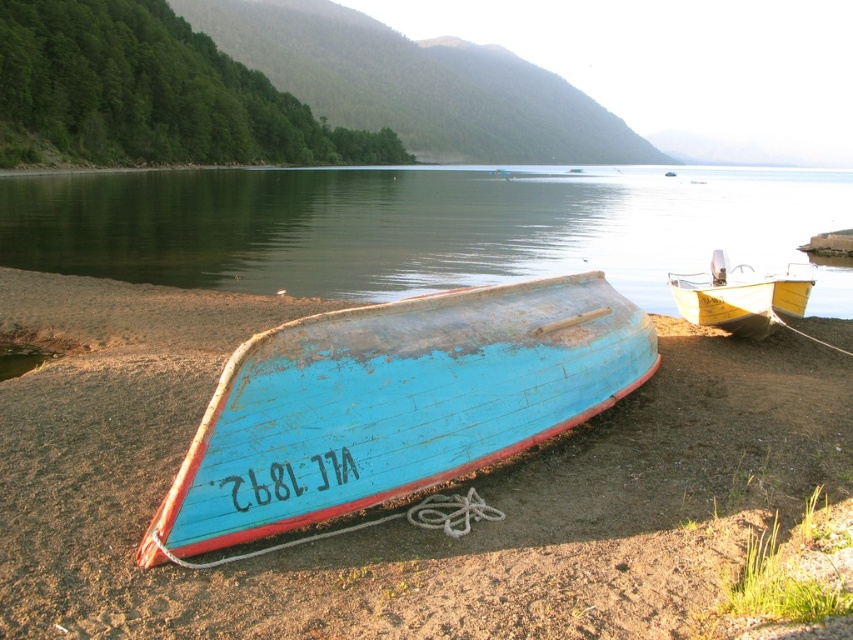
Question: Is blue wooden boat at center smaller than yellow wooden boat at center?

Choices:
 (A) no
 (B) yes

Answer: (A)

Question: Is blue wooden boat at center to the left of yellow wooden boat at center from the viewer's perspective?

Choices:
 (A) no
 (B) yes

Answer: (B)

Question: Which point is closer to the camera?

Choices:
 (A) (764, 333)
 (B) (476, 456)

Answer: (B)

Question: Which object is closer to the camera taking this photo?

Choices:
 (A) yellow wooden boat at center
 (B) blue wooden boat at center
 (C) blue wooden boat at lower center

Answer: (B)

Question: Which object appears closest to the camera in this image?

Choices:
 (A) blue wooden boat at lower center
 (B) blue wooden boat at center

Answer: (B)

Question: Does blue wooden boat at center lie behind yellow wooden boat at center?

Choices:
 (A) no
 (B) yes

Answer: (A)